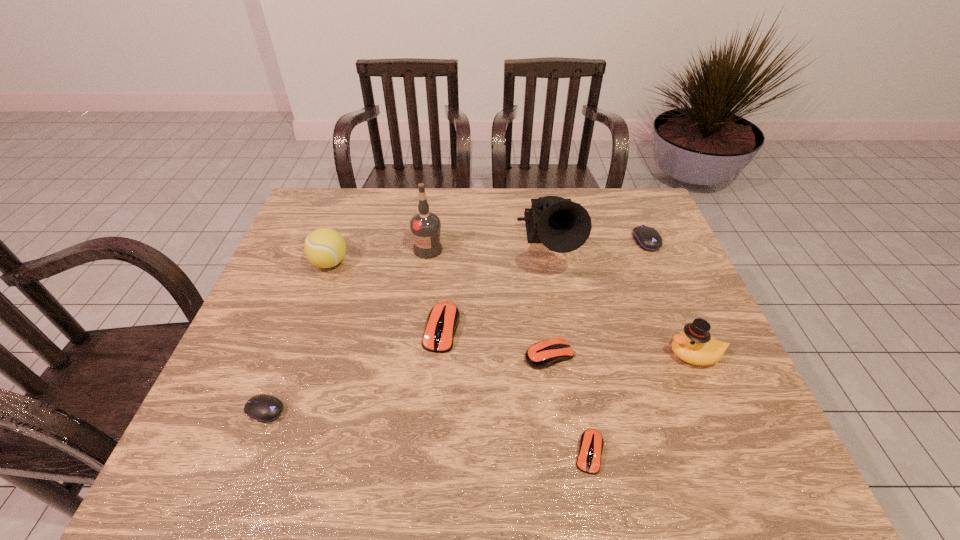
Find the location of a particular element. This screenshot has width=960, height=540. black phonograph_record is located at coordinates (561, 225).

Locate an element on the screen. vodka is located at coordinates (x=425, y=226).

Find the location of a particular element. yellow tennis ball is located at coordinates (325, 248).

This screenshot has height=540, width=960. What are the coordinates of `yellow duck` in the screenshot? It's located at (694, 345).

The image size is (960, 540). Identify the location of the fourth computer mouse from right to left. (443, 319).

This screenshot has width=960, height=540. I want to click on the leftmost orange computer mouse, so click(x=443, y=319).

Find the location of a particular element. The image size is (960, 540). the right black computer mouse is located at coordinates (647, 238).

Locate an element on the screen. the rightmost computer mouse is located at coordinates (647, 238).

Image resolution: width=960 pixels, height=540 pixels. What are the coordinates of `the second smallest orange computer mouse` in the screenshot? It's located at (543, 354).

Find the location of `the fourth farthest computer mouse`. the fourth farthest computer mouse is located at coordinates (264, 408).